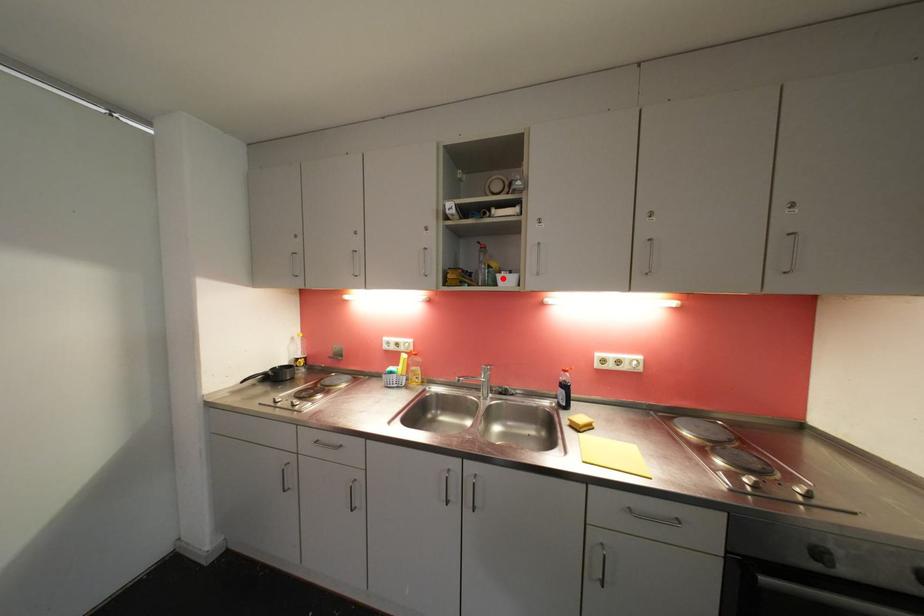
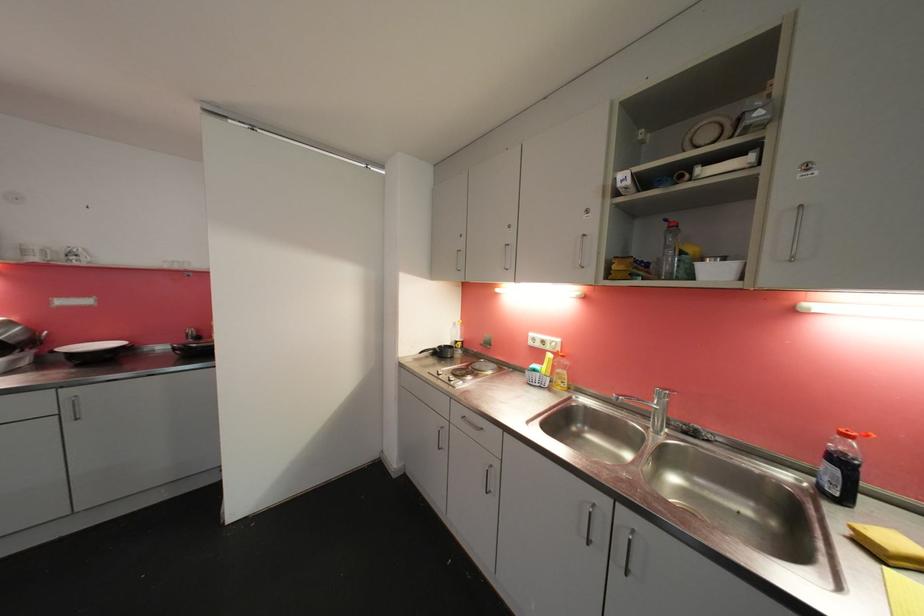
Question: I am providing you with two images of the same scene from different viewpoints. A red point is marked on the first image. Is the red point's position out of view in image 2?

Choices:
 (A) Yes
 (B) No

Answer: (B)